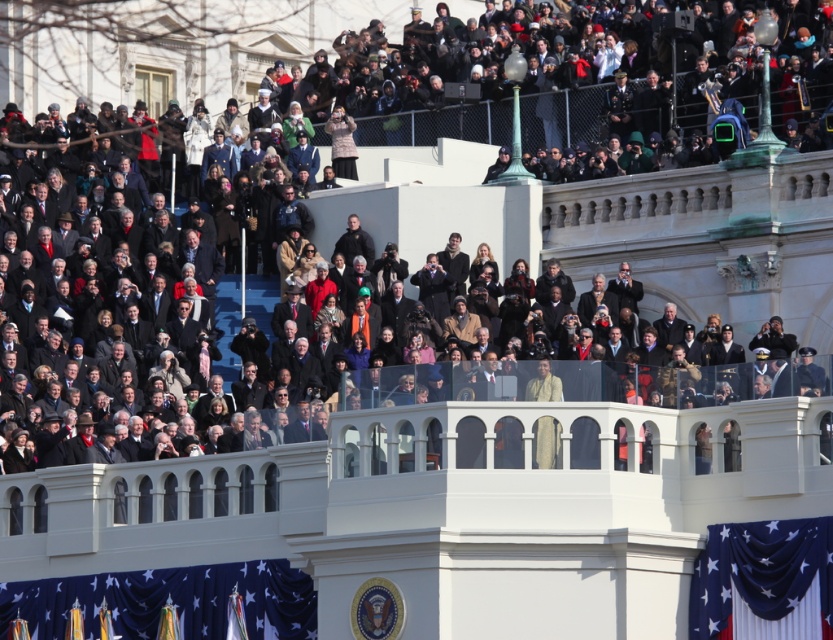
You are a photographer at this event and need to position yourself to capture both the blue fabric flag at lower left and the blue velvet flag at lower right in a single shot. Which flag should you focus on to ensure both are in frame without moving the camera?

The blue fabric flag at lower left has a larger width than the blue velvet flag at lower right, so focusing on the blue fabric flag at lower left will ensure both flags are captured in the frame since it occupies more space.

You are a photographer at the event and need to capture both the blue fabric flag at lower left and the blue velvet flag at lower right in a single frame. Which flag should you focus on to ensure both are visible without moving the camera?

The blue fabric flag at lower left is much taller than the blue velvet flag at lower right, so focusing on the taller blue fabric flag at lower left will help ensure both flags are in frame without needing to adjust the camera position.